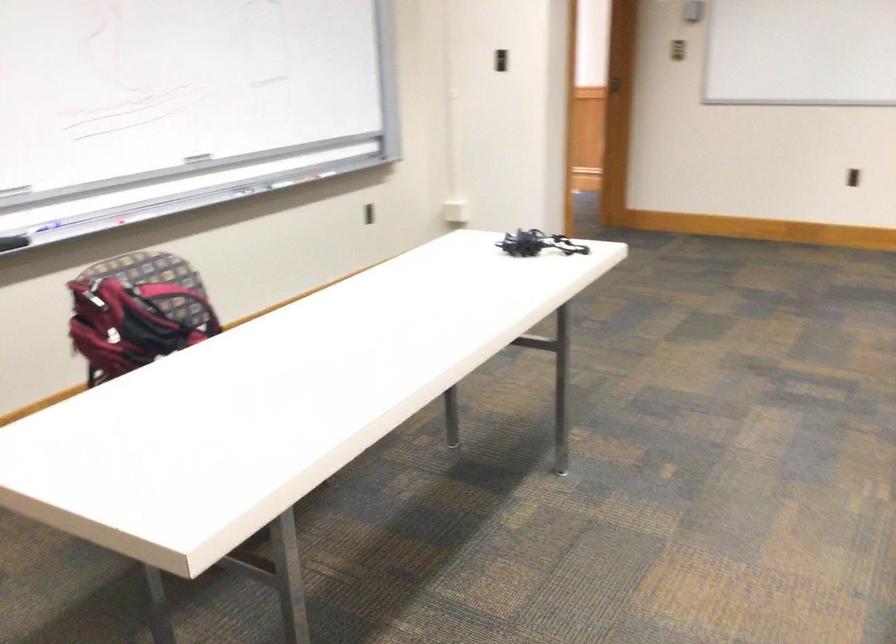
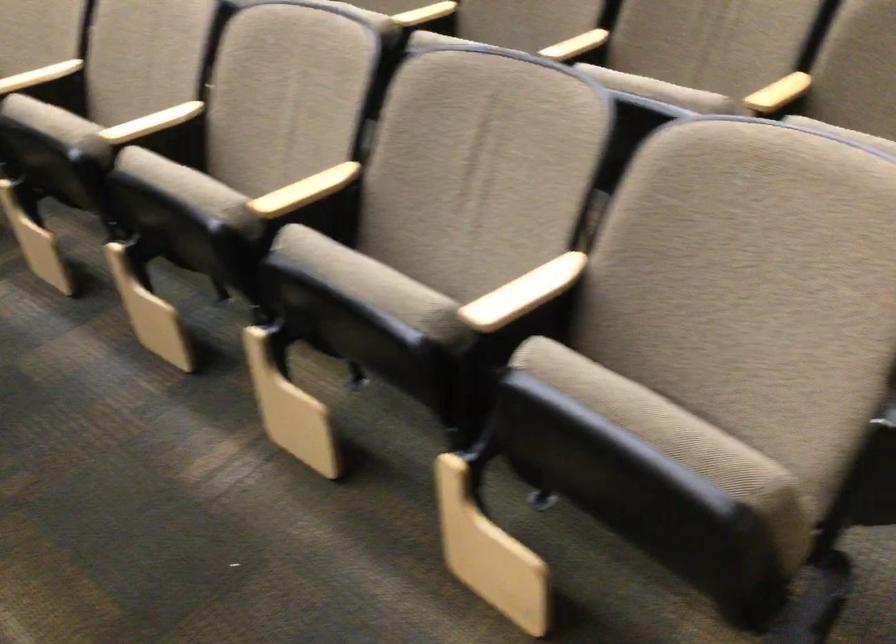
Based on the continuous images, in which direction is the camera rotating?

The rotation direction of the camera is right-down.